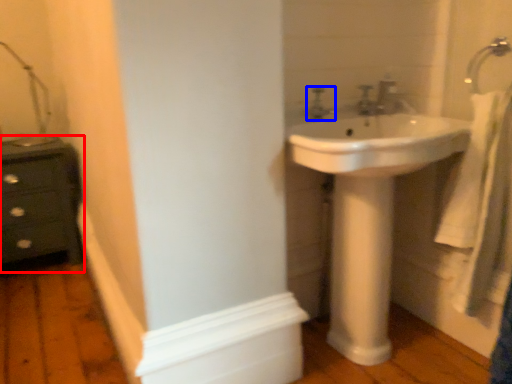
Question: Which object appears closest to the camera in this image, chest of drawers (highlighted by a red box) or tap (highlighted by a blue box)?

Choices:
 (A) chest of drawers
 (B) tap

Answer: (B)